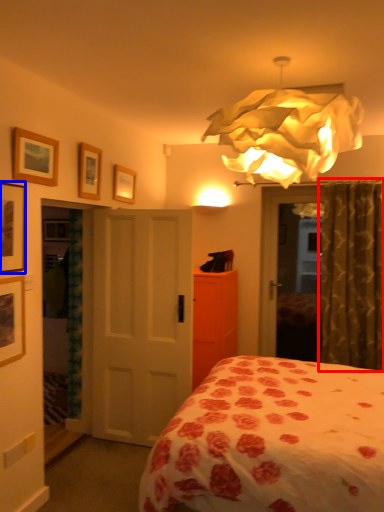
Question: Which point is closer to the camera, curtain (highlighted by a red box) or picture frame (highlighted by a blue box)?

Choices:
 (A) curtain
 (B) picture frame

Answer: (B)